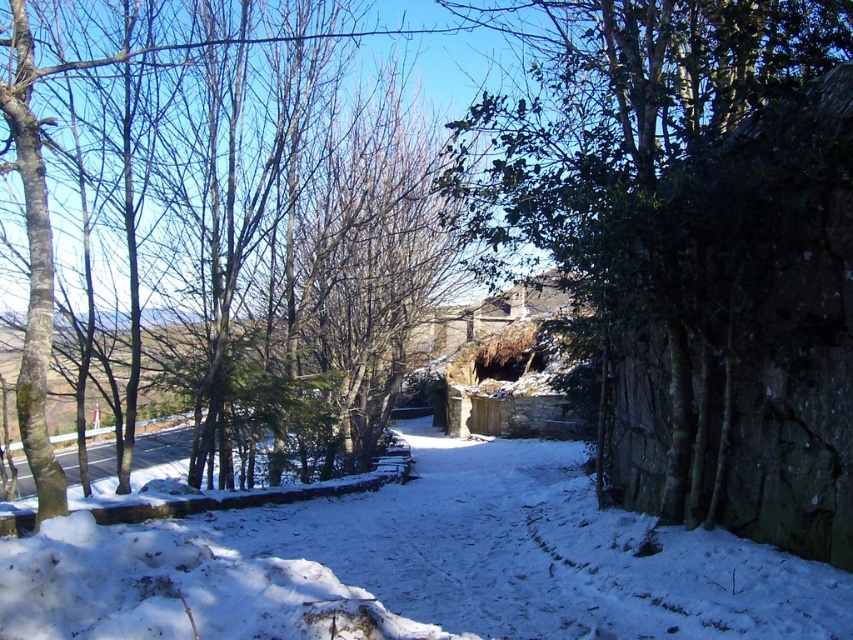
Question: Does white powdery snow at center appear on the left side of brown bark tree at left?

Choices:
 (A) no
 (B) yes

Answer: (A)

Question: Which of the following is the farthest from the observer?

Choices:
 (A) (582, 16)
 (B) (24, 113)

Answer: (A)

Question: Is white powdery snow at center to the right of brown bark tree at left from the viewer's perspective?

Choices:
 (A) no
 (B) yes

Answer: (B)

Question: Observing the image, what is the correct spatial positioning of green leafy tree at right in reference to brown bark tree at left?

Choices:
 (A) above
 (B) below

Answer: (A)

Question: Which object appears closest to the camera in this image?

Choices:
 (A) white powdery snow at center
 (B) green leafy tree at right

Answer: (A)

Question: Estimate the real-world distances between objects in this image. Which object is farther from the brown bark tree at left?

Choices:
 (A) white powdery snow at center
 (B) green leafy tree at right

Answer: (B)